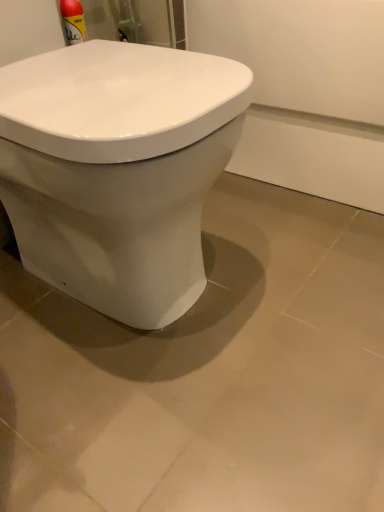
Question: From a real-world perspective, is matte white ceramic tile at center located higher than white glossy toilet at center?

Choices:
 (A) no
 (B) yes

Answer: (A)

Question: Are matte white ceramic tile at center and white glossy toilet at center far apart?

Choices:
 (A) yes
 (B) no

Answer: (B)

Question: From a real-world perspective, is matte white ceramic tile at center below white glossy toilet at center?

Choices:
 (A) yes
 (B) no

Answer: (A)

Question: Considering the relative sizes of matte white ceramic tile at center and white glossy toilet at center in the image provided, is matte white ceramic tile at center bigger than white glossy toilet at center?

Choices:
 (A) no
 (B) yes

Answer: (A)

Question: Considering the relative positions of matte white ceramic tile at center and white glossy toilet at center in the image provided, is matte white ceramic tile at center in front of white glossy toilet at center?

Choices:
 (A) no
 (B) yes

Answer: (A)

Question: Is the depth of matte white ceramic tile at center greater than that of white glossy toilet at center?

Choices:
 (A) no
 (B) yes

Answer: (B)

Question: From a real-world perspective, is white glossy toilet at center under matte white ceramic tile at center?

Choices:
 (A) yes
 (B) no

Answer: (B)

Question: Is white glossy toilet at center to the right of matte white ceramic tile at center from the viewer's perspective?

Choices:
 (A) yes
 (B) no

Answer: (B)

Question: Does white glossy toilet at center have a greater height compared to matte white ceramic tile at center?

Choices:
 (A) no
 (B) yes

Answer: (B)

Question: Can you confirm if white glossy toilet at center is shorter than matte white ceramic tile at center?

Choices:
 (A) yes
 (B) no

Answer: (B)

Question: Does white glossy toilet at center come in front of matte white ceramic tile at center?

Choices:
 (A) no
 (B) yes

Answer: (B)

Question: From the image's perspective, does white glossy toilet at center appear lower than matte white ceramic tile at center?

Choices:
 (A) no
 (B) yes

Answer: (A)

Question: Is white glossy toilet at center taller or shorter than matte white ceramic tile at center?

Choices:
 (A) tall
 (B) short

Answer: (A)